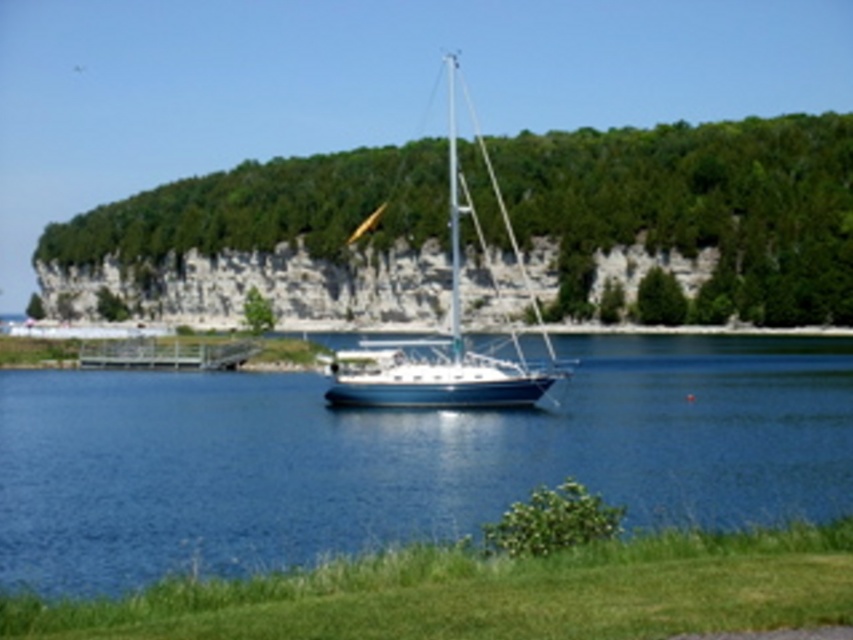
Does point (366, 381) come closer to viewer compared to point (181, 355)?

Yes, point (366, 381) is closer to viewer.

Does blue glossy sailboat at center have a smaller size compared to wooden planks at lower left?

No, blue glossy sailboat at center is not smaller than wooden planks at lower left.

At what (x,y) coordinates should I click in order to perform the action: click on blue glossy sailboat at center. Please return your answer as a coordinate pair (x, y). The height and width of the screenshot is (640, 853). Looking at the image, I should click on point(436,346).

This screenshot has height=640, width=853. I want to click on blue glossy sailboat at center, so click(x=436, y=346).

Is blue glossy water at center positioned behind wooden planks at lower left?

That is False.

Based on the photo, does blue glossy water at center have a smaller size compared to wooden planks at lower left?

Actually, blue glossy water at center might be larger than wooden planks at lower left.

Identify the location of blue glossy water at center. (403, 458).

Locate an element on the screen. Image resolution: width=853 pixels, height=640 pixels. blue glossy water at center is located at coordinates click(x=403, y=458).

Between point (4, 392) and point (461, 349), which one is positioned behind?

Positioned behind is point (4, 392).

Is blue glossy water at center to the right of blue glossy sailboat at center from the viewer's perspective?

Correct, you'll find blue glossy water at center to the right of blue glossy sailboat at center.

Is point (360, 544) closer to camera compared to point (502, 380)?

Yes, it is.

Find the location of a particular element. Image resolution: width=853 pixels, height=640 pixels. blue glossy water at center is located at coordinates (403, 458).